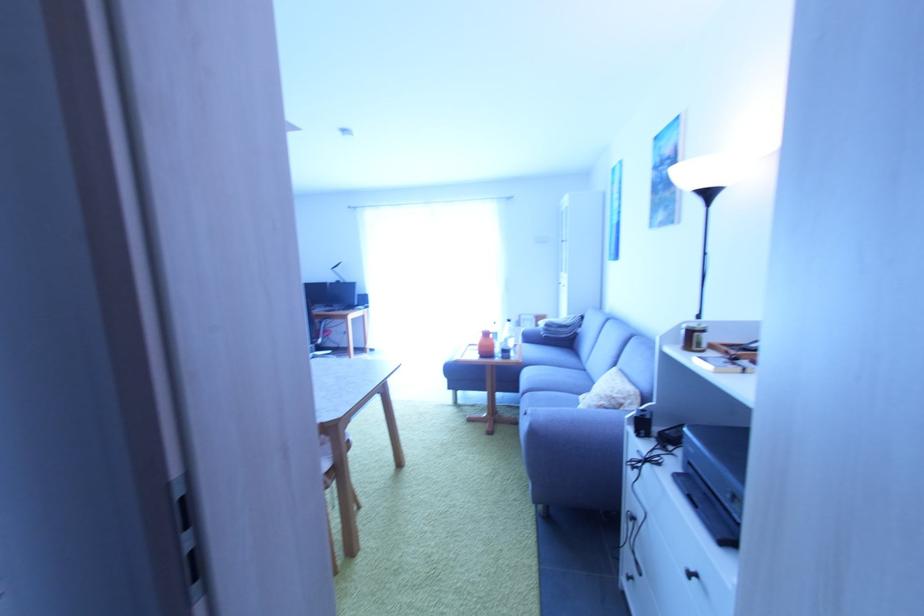
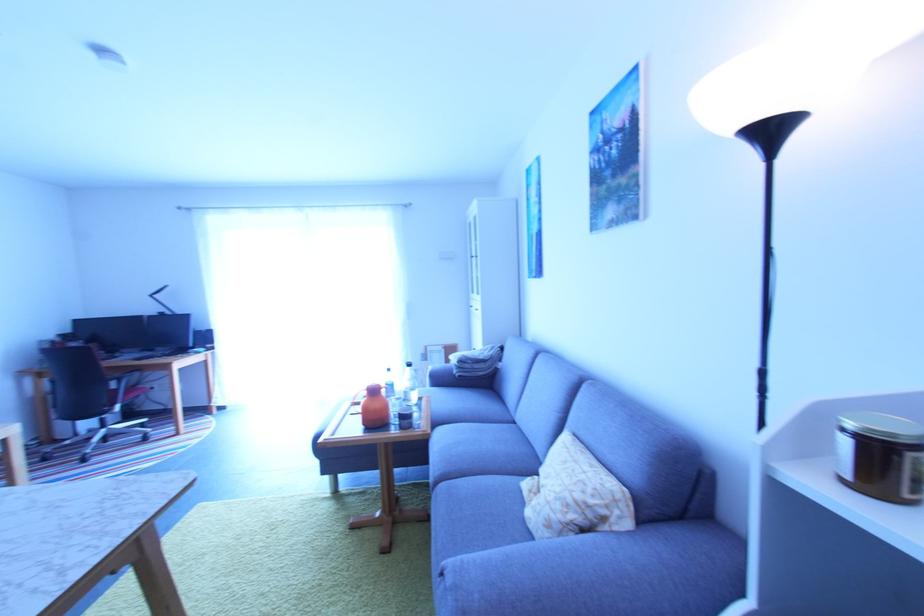
Question: The first image is from the beginning of the video and the second image is from the end. How did the camera likely rotate when shooting the video?

Choices:
 (A) Left
 (B) Right
 (C) Up
 (D) Down

Answer: (B)